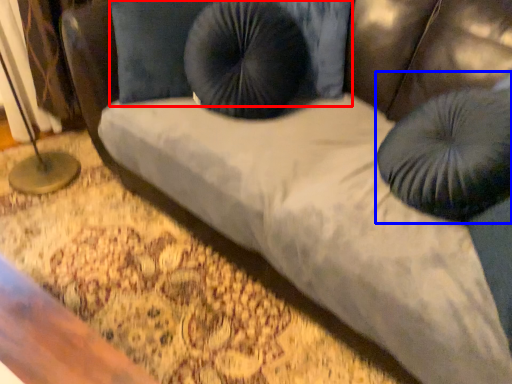
Question: Which of the following is the farthest to the observer, pillow (highlighted by a red box) or bean bag chair (highlighted by a blue box)?

Choices:
 (A) pillow
 (B) bean bag chair

Answer: (A)